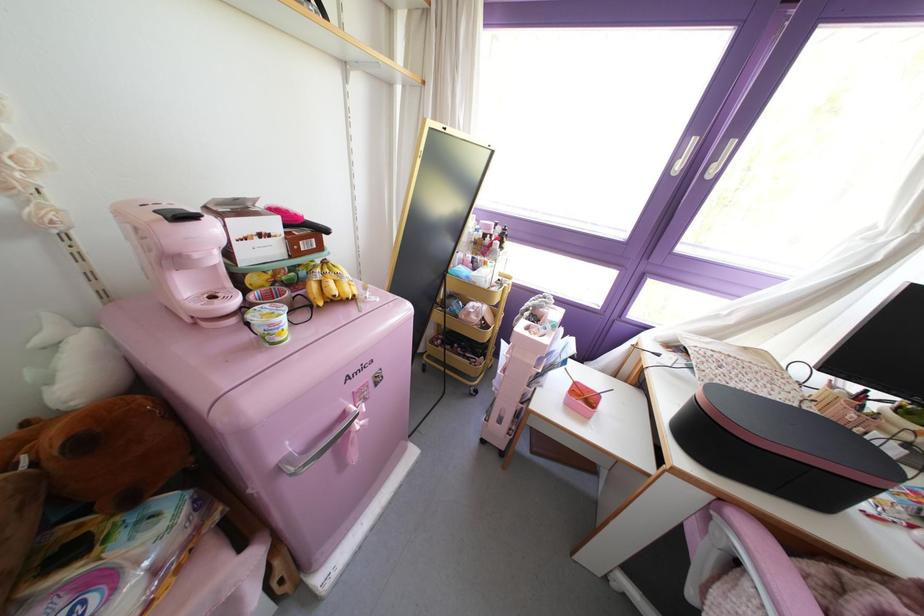
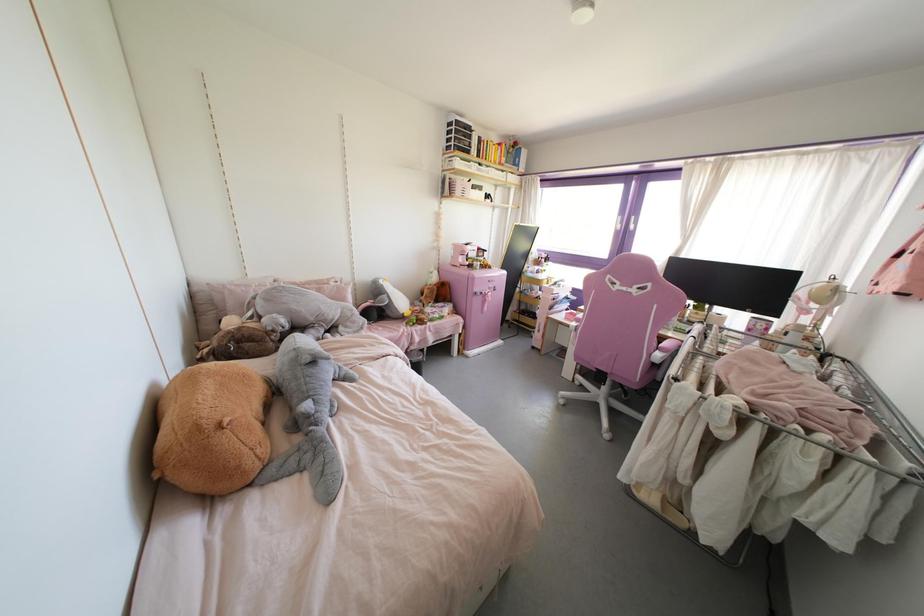
Question: Which direction would the cameraman need to move to produce the second image? Reply with the corresponding letter.

Choices:
 (A) Left
 (B) Right
 (C) Forward
 (D) Backward

Answer: (D)